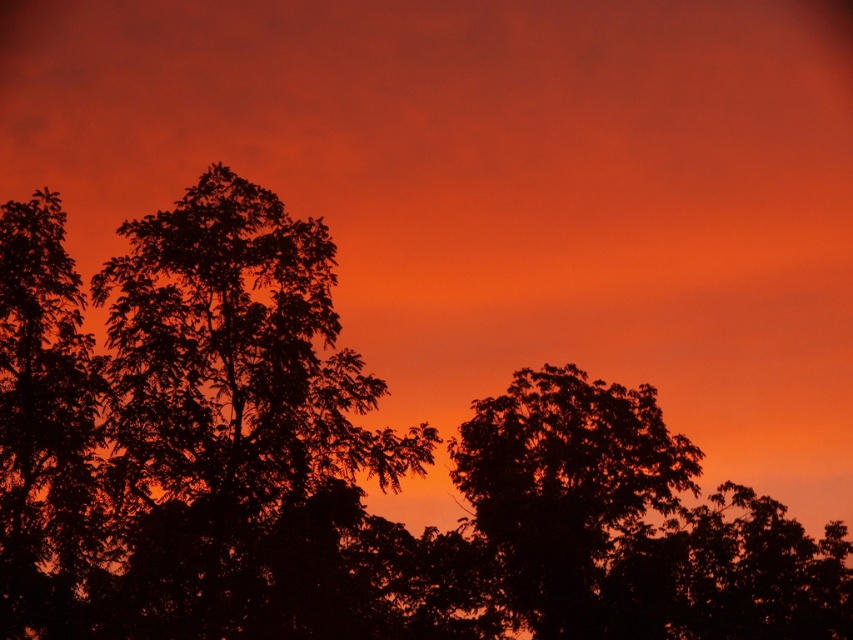
Question: Which point is farther from the camera taking this photo?

Choices:
 (A) (3, 484)
 (B) (521, 516)

Answer: (B)

Question: Is silhouette leafy tree at center below silhouette tree at center?

Choices:
 (A) no
 (B) yes

Answer: (A)

Question: Which point is closer to the camera?

Choices:
 (A) silhouette leafy tree at left
 (B) silhouette leafy tree at center
 (C) silhouette tree at center

Answer: (B)

Question: Is silhouette leafy tree at center positioned at the back of silhouette leafy tree at left?

Choices:
 (A) no
 (B) yes

Answer: (A)

Question: Is silhouette tree at center behind silhouette leafy tree at left?

Choices:
 (A) no
 (B) yes

Answer: (B)

Question: Which point appears farthest from the camera in this image?

Choices:
 (A) (547, 600)
 (B) (285, 401)
 (C) (15, 582)

Answer: (A)